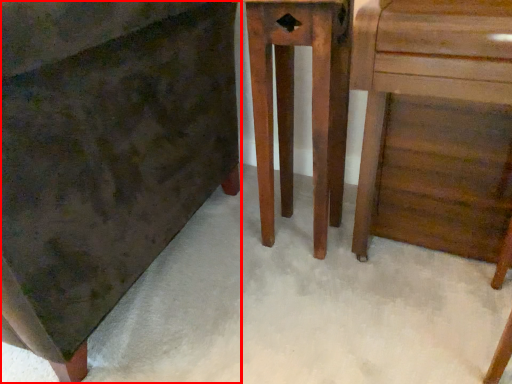
Question: Where is chest of drawers (annotated by the red box) located in relation to furniture in the image?

Choices:
 (A) right
 (B) left

Answer: (B)